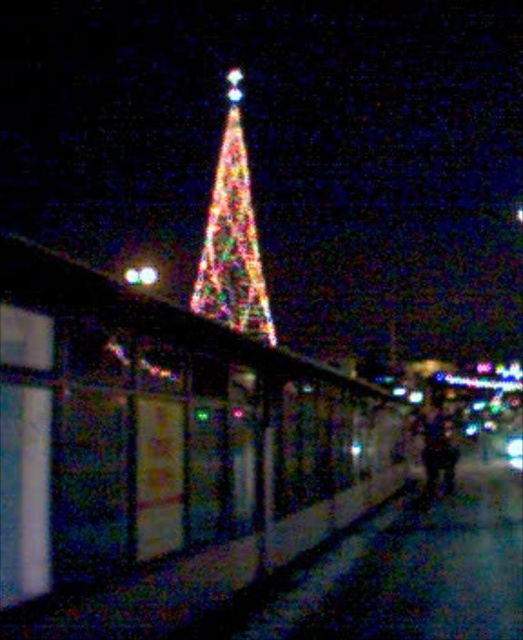
Question: Is iridescent glass christmas tree at center thinner than multicolored fabric at center?

Choices:
 (A) yes
 (B) no

Answer: (B)

Question: Is iridescent glass christmas tree at center in front of multicolored fabric at center?

Choices:
 (A) no
 (B) yes

Answer: (A)

Question: Which of the following is the farthest from the observer?

Choices:
 (A) multicolored fabric at center
 (B) iridescent glass christmas tree at center

Answer: (B)

Question: Observing the image, what is the correct spatial positioning of iridescent glass christmas tree at center in reference to multicolored fabric at center?

Choices:
 (A) above
 (B) below

Answer: (A)